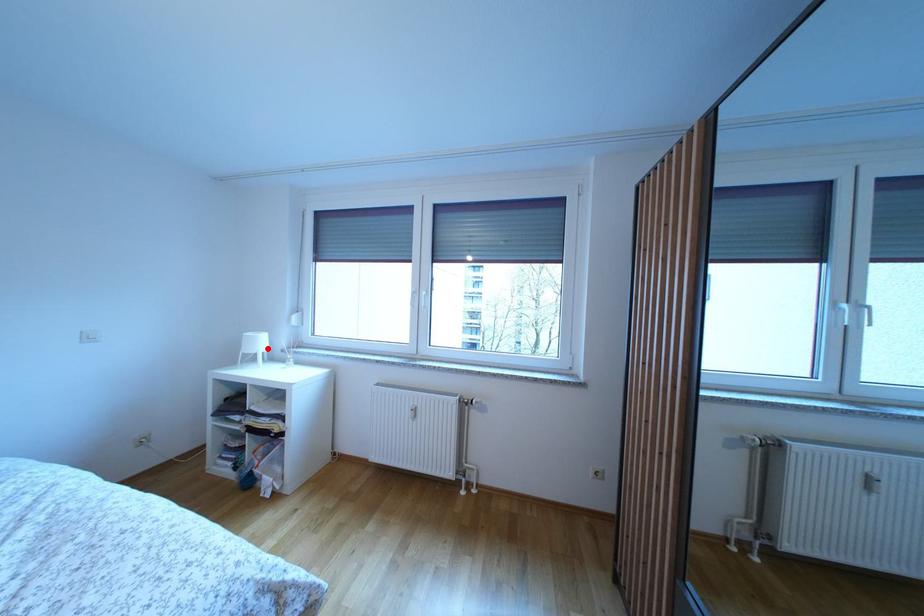
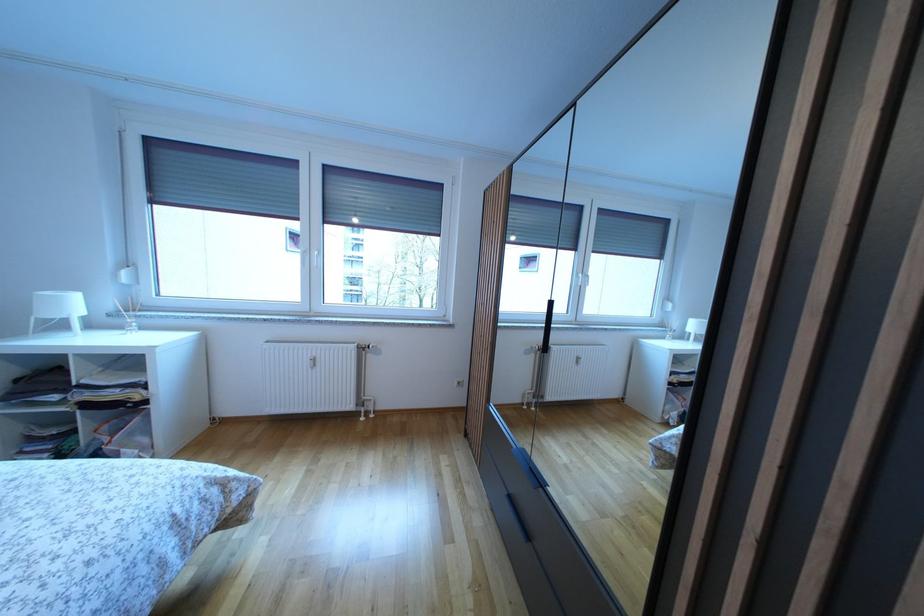
Find the pixel in the second image that matches the highlighted location in the first image.

(78, 310)